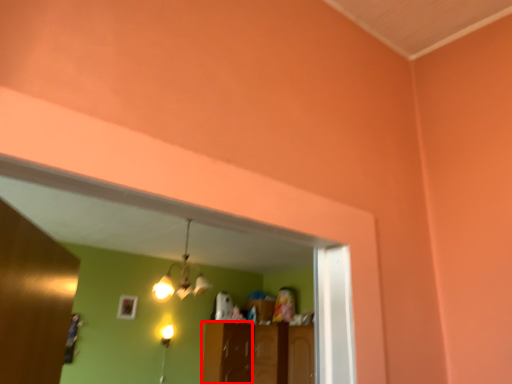
Question: Where is cabinetry (annotated by the red box) located in relation to light fixture in the image?

Choices:
 (A) right
 (B) left

Answer: (A)